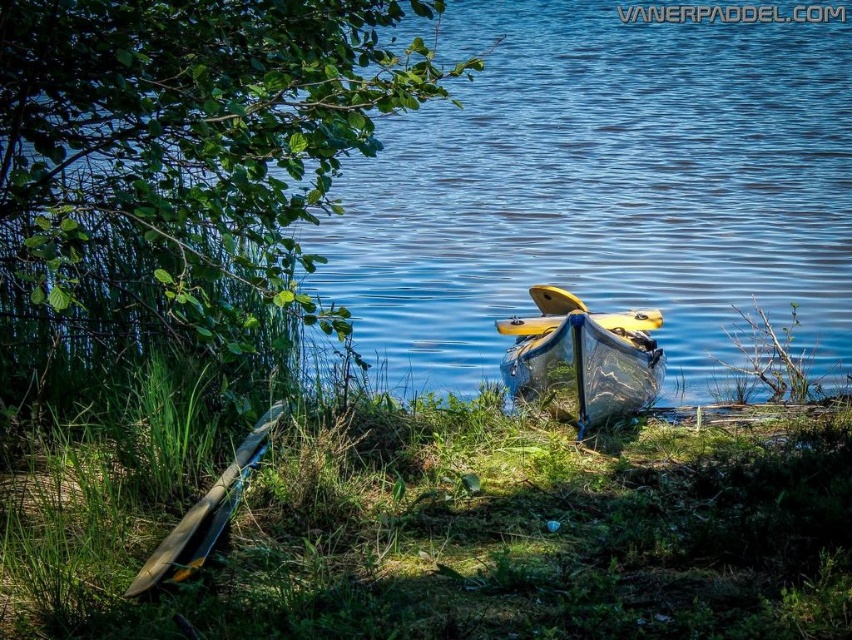
You are planning to take a photo of the green leafy tree at upper left and the matte yellow canoe at lower left. Which object appears narrower in the photo?

The green leafy tree at upper left appears narrower than the matte yellow canoe at lower left because it is thinner.

You are standing at the edge of the lake and want to pick up the wooden paddle. Which object is closer to your current position between the green grass at lower left and the yellow glossy kayak at center?

The green grass at lower left is below the yellow glossy kayak at center, so the green grass at lower left is closer to your current position.